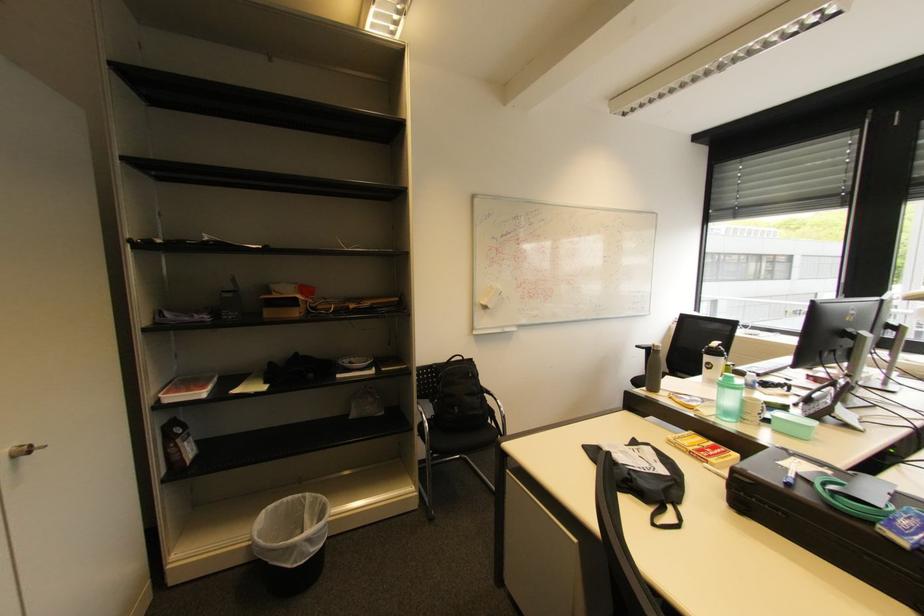
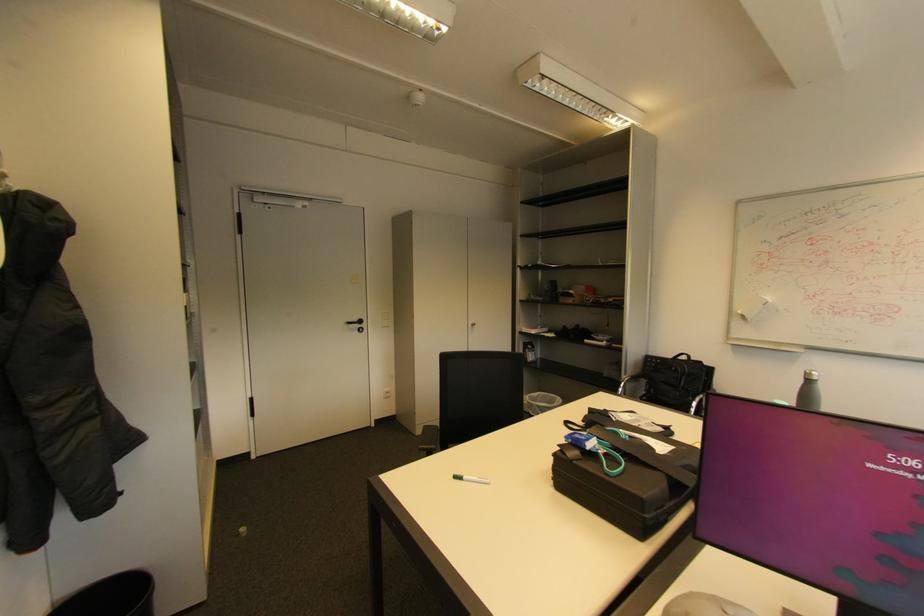
Where in the second image is the point corresponding to (30,453) from the first image?

(479, 326)